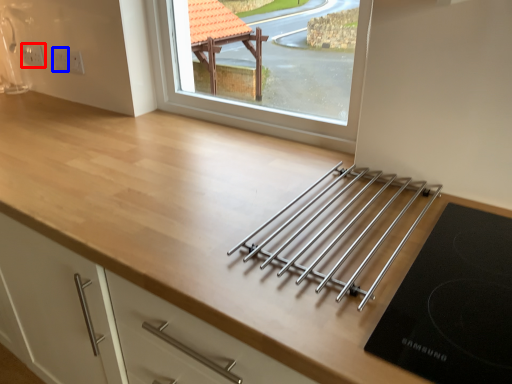
Question: Among these objects, which one is nearest to the camera, electric outlet (highlighted by a red box) or electric outlet (highlighted by a blue box)?

Choices:
 (A) electric outlet
 (B) electric outlet

Answer: (B)